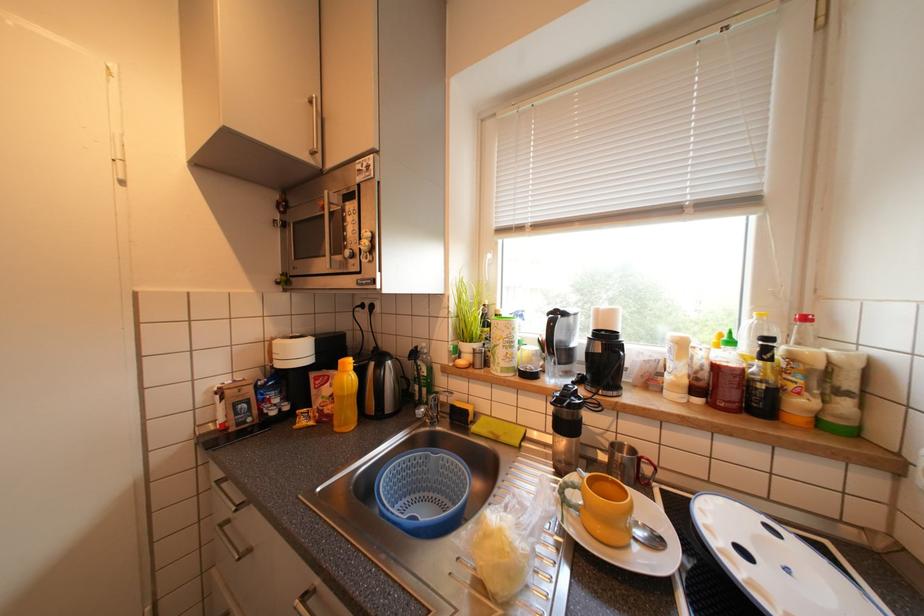
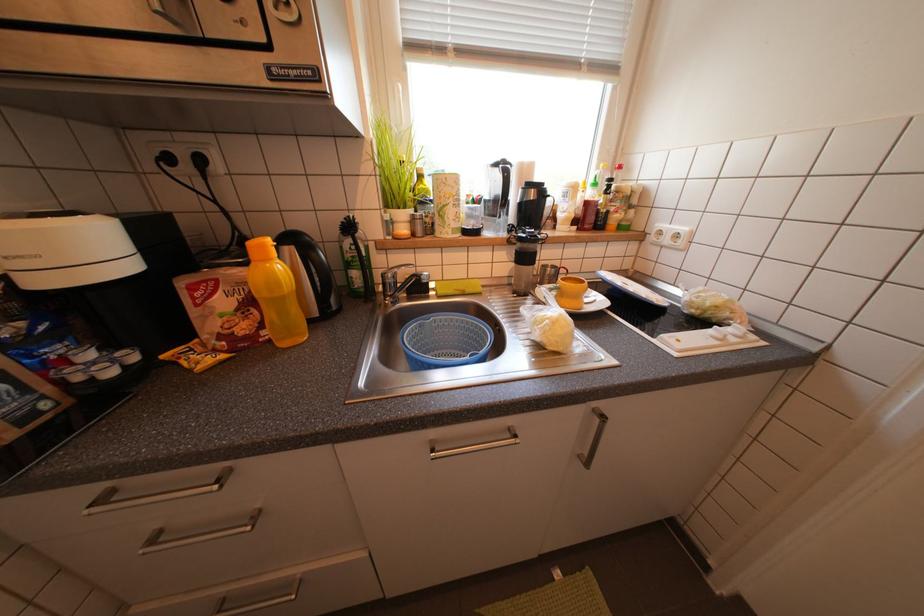
How did the camera likely rotate?

The camera's rotation is toward right-down.